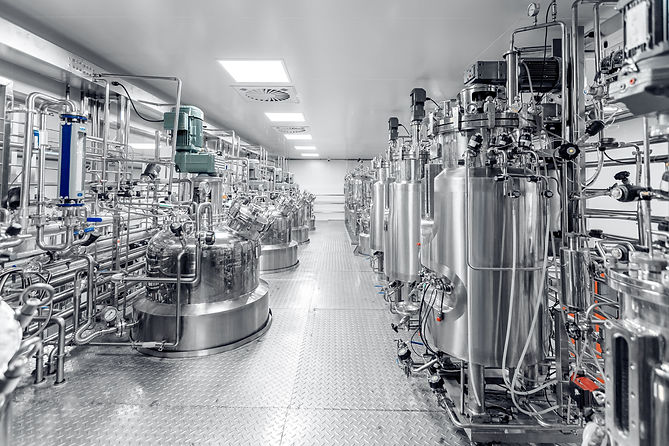
Identify the location of black plug. Image resolution: width=669 pixels, height=446 pixels. (112, 83).